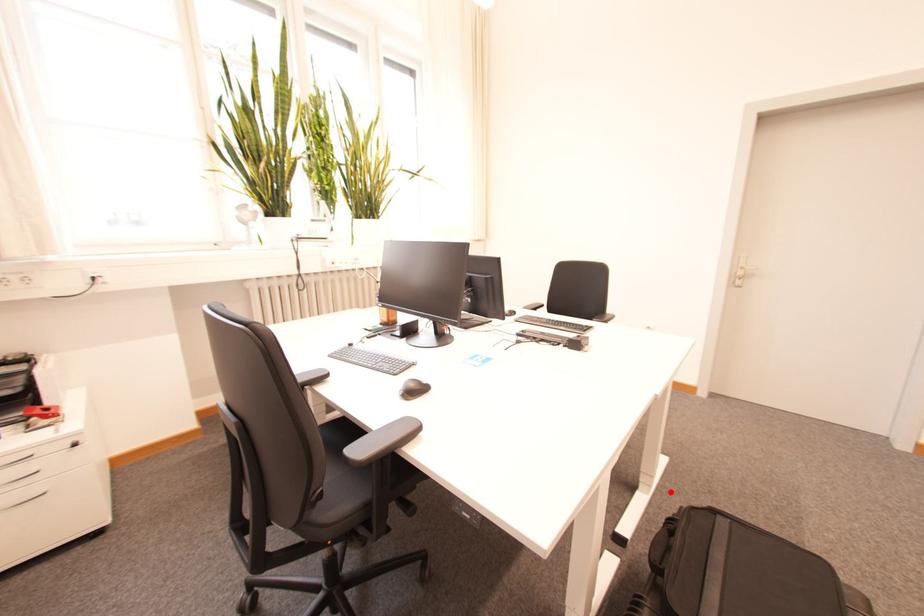
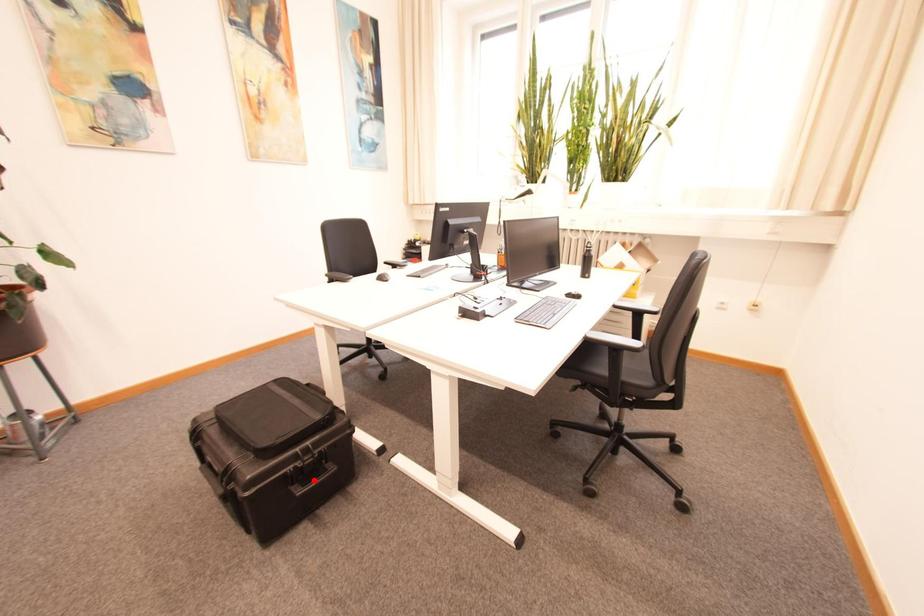
I am providing you with two images of the same scene from different viewpoints. A red point is marked on the first image and another point is marked on the second image. Does the point marked in image1 correspond to the same location as the one in image2?

No